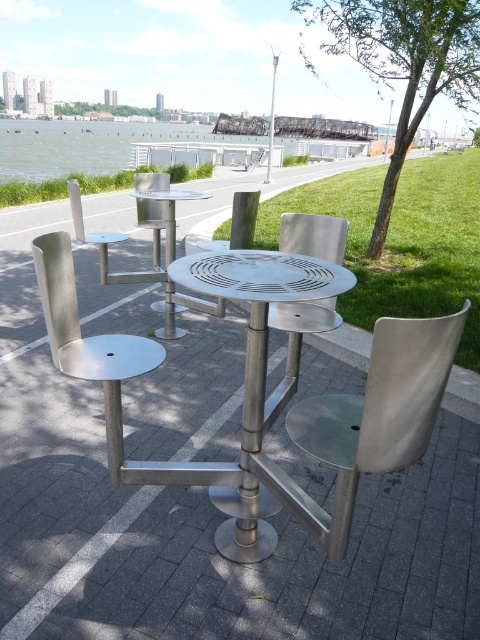
You are standing at the center of the round table and want to reach the polished silver chair at left. What are the coordinates of the direction you should walk to reach it?

The coordinates of the direction to reach the polished silver chair at left are at point (x=90, y=344).

You are planning to move a large potted plant that is 1 meter wide into the seating area. Considering the space between the polished silver chair at left and the metallic pole at upper center, will it fit?

The polished silver chair at left is thinner than the metallic pole at upper center. However, the description does not provide the exact width of the space between them. Therefore, it is uncertain if the 1 meter wide potted plant will fit.

You are planning to set up a small garden near the polished silver chair at left and the metallic pole at upper center. Considering their sizes, which object should you place closer to avoid blocking the garden space?

The polished silver chair at left has a smaller size compared to the metallic pole at upper center, so you should place the smaller polished silver chair at left closer to the garden to avoid blocking the space.